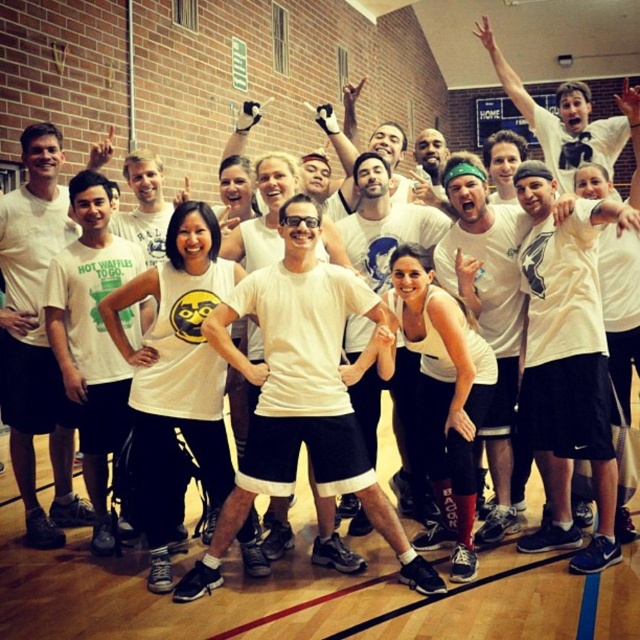
Question: Does white matte t-shirt at center have a lesser width compared to matte white t-shirt at center?

Choices:
 (A) no
 (B) yes

Answer: (A)

Question: Where is white matte t-shirt at center located in relation to matte white t-shirt at center in the image?

Choices:
 (A) right
 (B) left

Answer: (A)

Question: Is white matte t-shirt at center further to camera compared to matte white t-shirt at center?

Choices:
 (A) no
 (B) yes

Answer: (A)

Question: Which object appears closest to the camera in this image?

Choices:
 (A) white matte t-shirt at center
 (B) matte white t-shirt at center

Answer: (A)

Question: Which object appears closest to the camera in this image?

Choices:
 (A) matte white t-shirt at center
 (B) white matte t-shirt at center

Answer: (B)

Question: Which point is farther to the camera?

Choices:
 (A) matte white t-shirt at center
 (B) white matte t-shirt at center

Answer: (A)